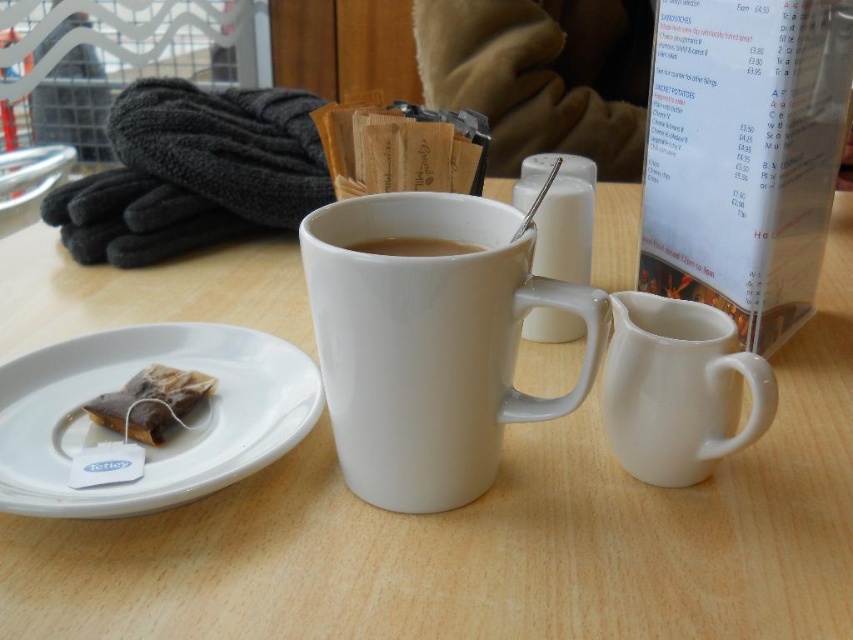
Question: Among these points, which one is farthest from the camera?

Choices:
 (A) (775, 394)
 (B) (381, 250)

Answer: (B)

Question: Considering the real-world distances, which object is farthest from the white ceramic saucer at lower left?

Choices:
 (A) white glossy creamer at right
 (B) white glossy mug at center

Answer: (A)

Question: Which object is positioned closest to the white glossy creamer at right?

Choices:
 (A) white matte cup at center
 (B) white glossy mug at center
 (C) brown paper tea bag at left
 (D) white ceramic saucer at lower left

Answer: (A)

Question: Is glossy ceramic mug at center above white matte cup at center?

Choices:
 (A) no
 (B) yes

Answer: (A)

Question: Is white glossy mug at center smaller than white ceramic saucer at lower left?

Choices:
 (A) yes
 (B) no

Answer: (B)

Question: Can you confirm if brown paper tea bag at left is positioned below white matte cup at center?

Choices:
 (A) yes
 (B) no

Answer: (A)